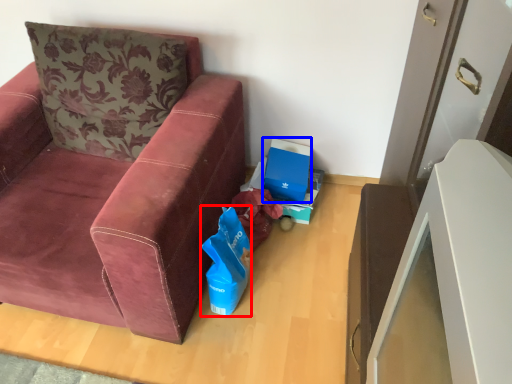
Question: Which object is further to the camera taking this photo, gift bag (highlighted by a red box) or cardboard box (highlighted by a blue box)?

Choices:
 (A) gift bag
 (B) cardboard box

Answer: (B)